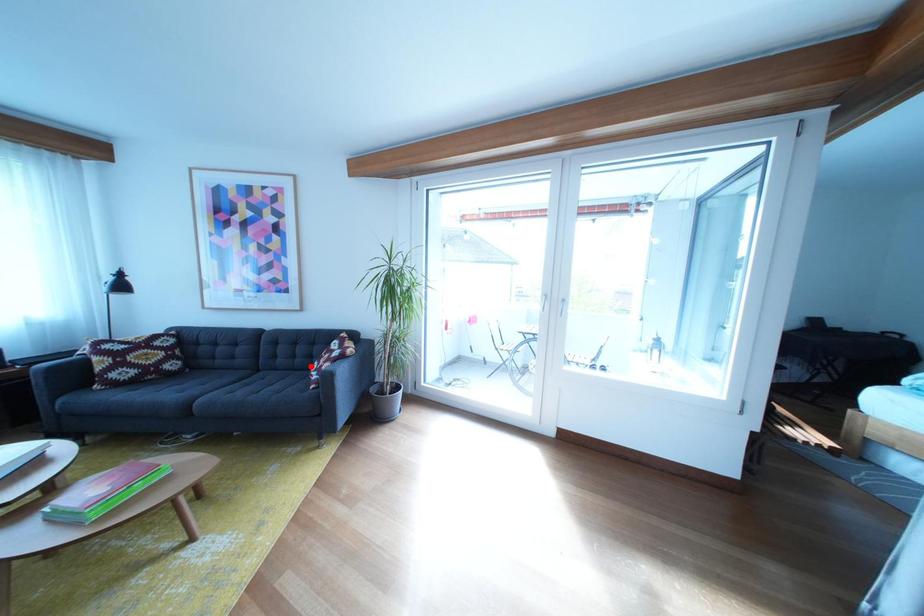
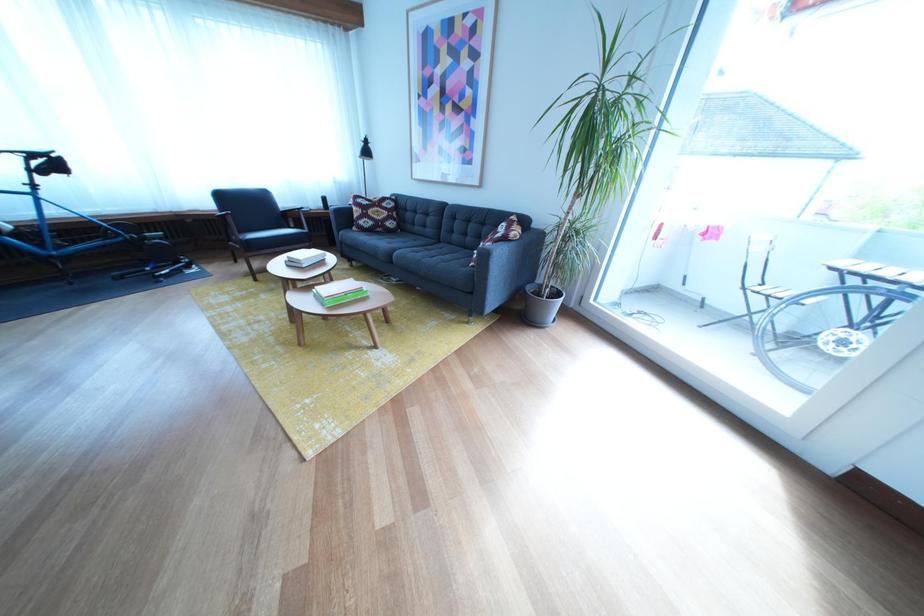
Question: I am providing you with two images of the same scene from different viewpoints. A red point is shown in image1. For the corresponding object point in image2, is it positioned nearer or farther from the camera?

Choices:
 (A) Nearer
 (B) Farther

Answer: (A)